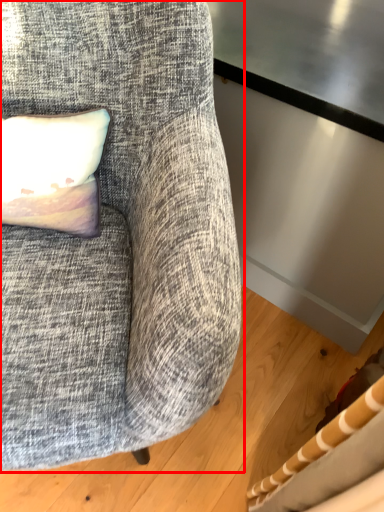
Question: From the image's perspective, where is chair (annotated by the red box) located relative to pillow?

Choices:
 (A) below
 (B) above

Answer: (A)